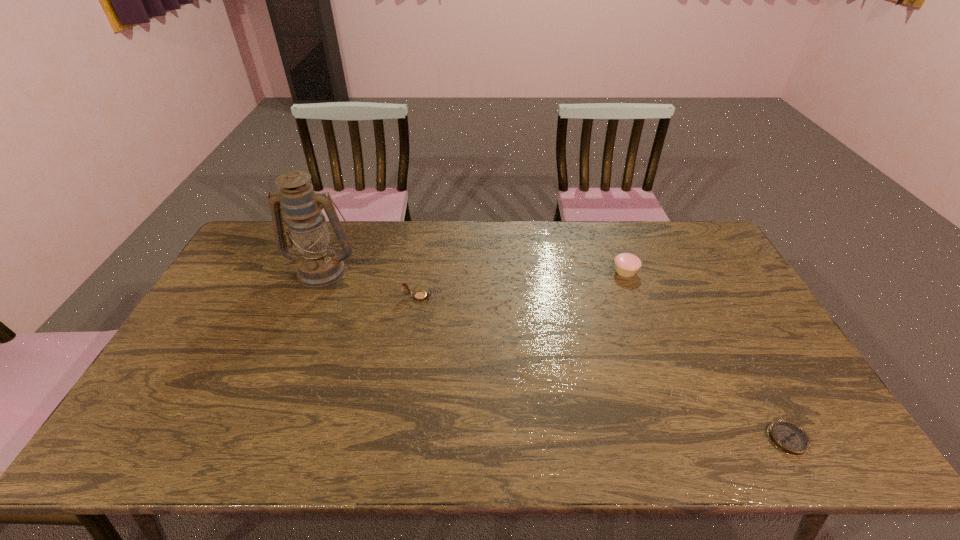
You are a GUI agent. You are given a task and a screenshot of the screen. Output one action in this format:
    pyautogui.click(x=<x>, y=<y>)
    Task: Click on the object that is the closest to the leftmost object
    The image size is (960, 540).
    Given the screenshot: What is the action you would take?
    pyautogui.click(x=420, y=295)

Where is `vacant area in the image that satisfies the following two spatial constraints: 1. on the front side of the second object from right to left; 2. on the face of the left compass`? The width and height of the screenshot is (960, 540). vacant area in the image that satisfies the following two spatial constraints: 1. on the front side of the second object from right to left; 2. on the face of the left compass is located at coordinates (635, 297).

Where is `free space that satisfies the following two spatial constraints: 1. on the front side of the cupcake; 2. on the right side of the tallest object`? The image size is (960, 540). free space that satisfies the following two spatial constraints: 1. on the front side of the cupcake; 2. on the right side of the tallest object is located at coordinates (322, 271).

The height and width of the screenshot is (540, 960). I want to click on vacant point that satisfies the following two spatial constraints: 1. on the face of the third farthest object; 2. on the right side of the nearer compass, so click(396, 439).

This screenshot has height=540, width=960. Find the location of `vacant area in the image that satisfies the following two spatial constraints: 1. on the front side of the rightmost object; 2. on the left side of the cupcake`. vacant area in the image that satisfies the following two spatial constraints: 1. on the front side of the rightmost object; 2. on the left side of the cupcake is located at coordinates (687, 439).

The height and width of the screenshot is (540, 960). Find the location of `free space that satisfies the following two spatial constraints: 1. on the face of the left compass; 2. on the left side of the shorter compass`. free space that satisfies the following two spatial constraints: 1. on the face of the left compass; 2. on the left side of the shorter compass is located at coordinates (396, 439).